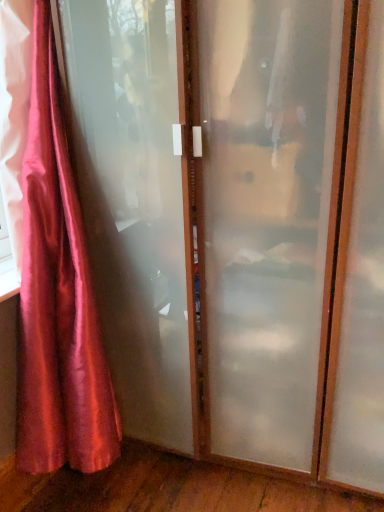
Measure the distance between point (62, 288) and camera.

They are 4.48 feet apart.

Image resolution: width=384 pixels, height=512 pixels. Identify the location of satin curtain at left. point(58,297).

What do you see at coordinates (58, 297) in the screenshot?
I see `satin curtain at left` at bounding box center [58, 297].

Identify the location of satin curtain at left. The width and height of the screenshot is (384, 512). (58, 297).